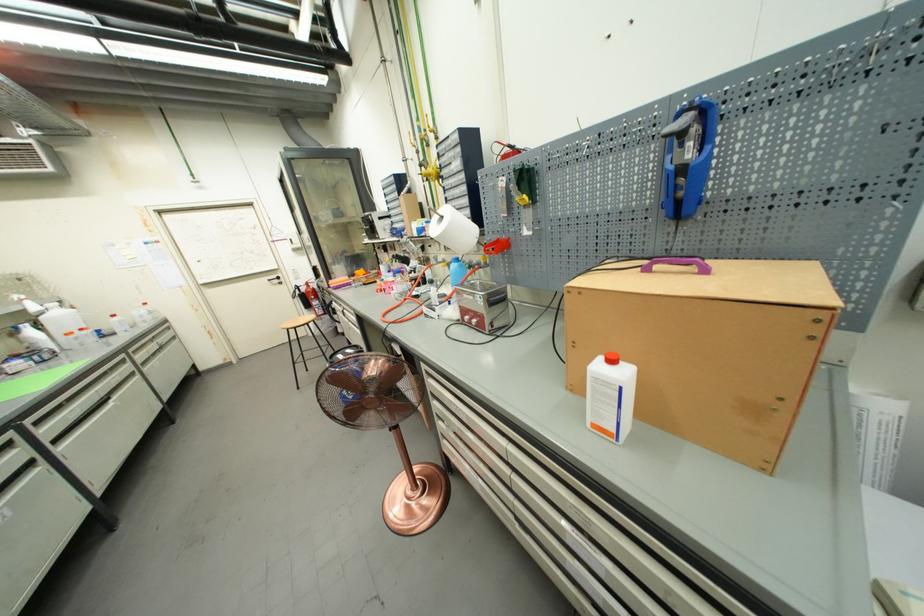
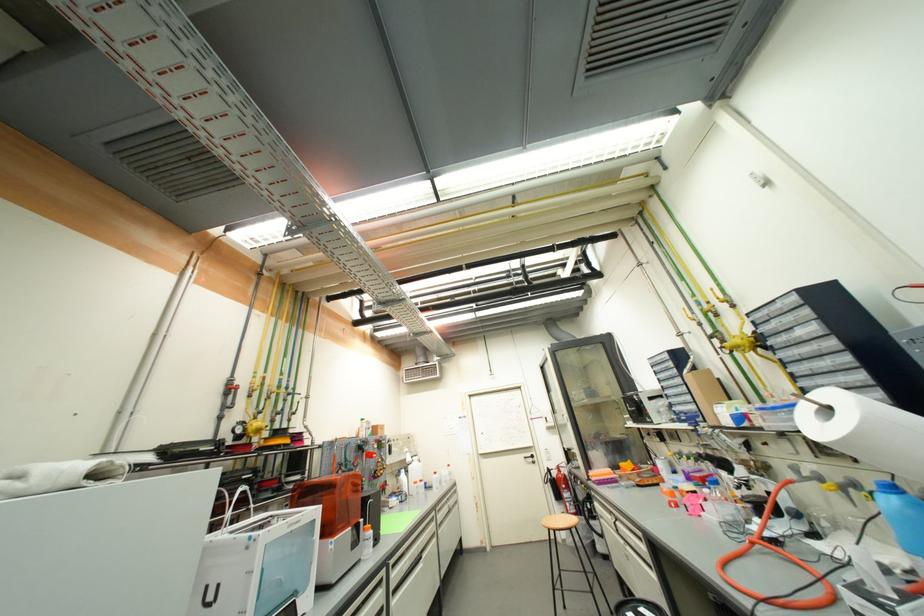
Locate, in the second image, the point that corresponds to point (274, 282) in the first image.

(530, 459)